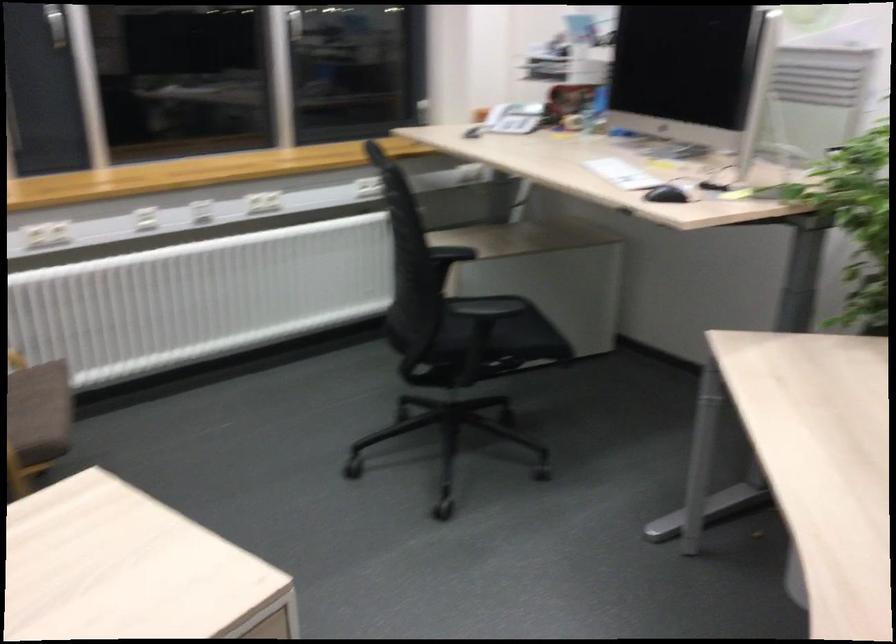
You are a GUI agent. You are given a task and a screenshot of the screen. Output one action in this format:
    pyautogui.click(x=<x>, y=<y>)
    Task: Click on the black chair armrest
    
    Given the screenshot: What is the action you would take?
    pyautogui.click(x=452, y=252)